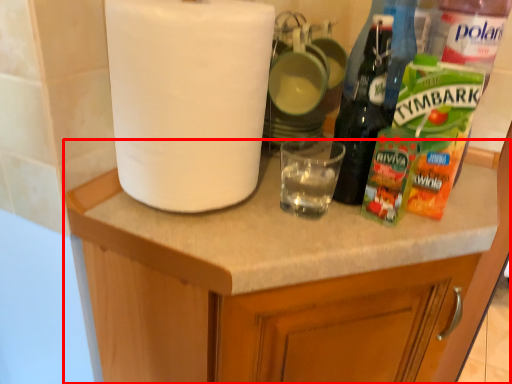
Question: Observing the image, what is the correct spatial positioning of cabinetry (annotated by the red box) in reference to paper towel?

Choices:
 (A) right
 (B) left

Answer: (A)